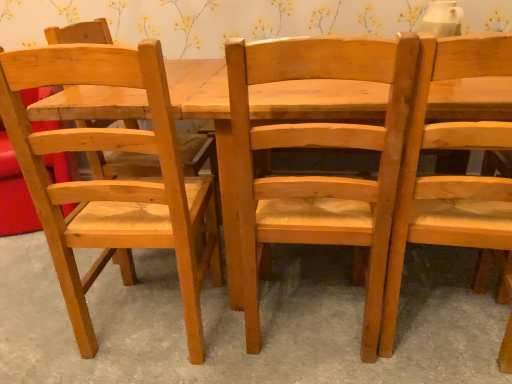
At what (x,y) coordinates should I click in order to perform the action: click on free space to the back side of natural wood chair at right, the 3th chair viewed from the left. Please return your answer as a coordinate pair (x, y). Looking at the image, I should click on (407, 262).